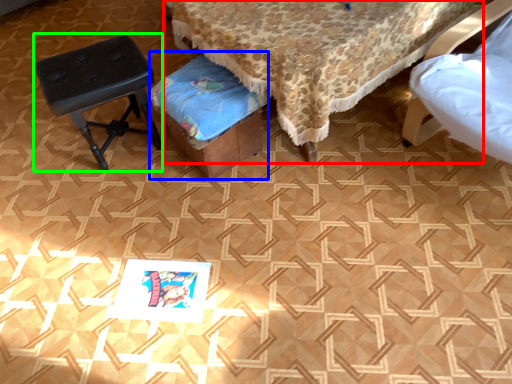
Question: Considering the real-world distances, which object is closest to furniture (highlighted by a red box)? music stool (highlighted by a blue box) or stool (highlighted by a green box).

Choices:
 (A) music stool
 (B) stool

Answer: (A)